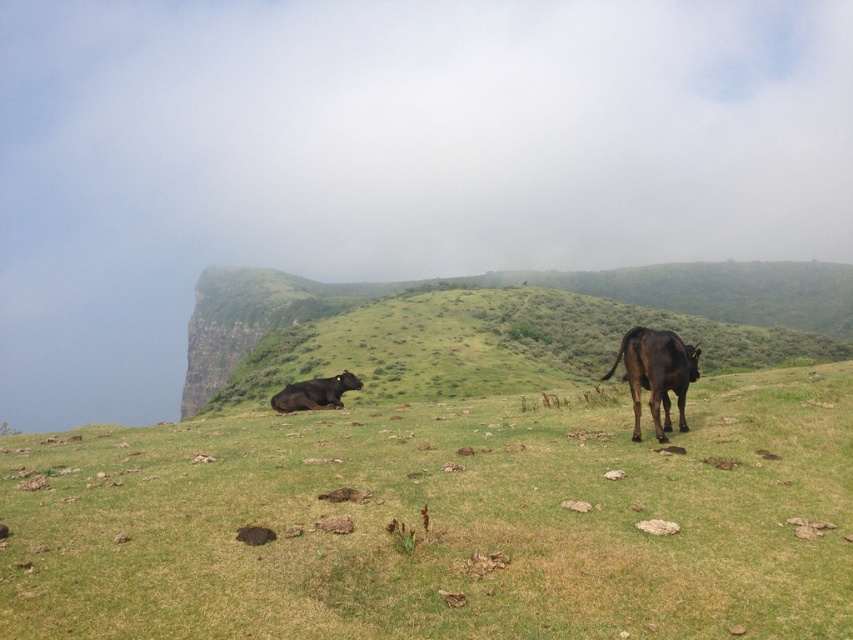
Question: Considering the real-world distances, which object is farthest from the green grassy at center?

Choices:
 (A) green grassy hillside at center
 (B) shiny brown bull at right
 (C) shiny black cow at center

Answer: (A)

Question: Can you confirm if green grassy hillside at center is positioned to the right of shiny black cow at center?

Choices:
 (A) yes
 (B) no

Answer: (B)

Question: Among these points, which one is farthest from the camera?

Choices:
 (A) (338, 506)
 (B) (344, 376)
 (C) (627, 348)
 (D) (187, 330)

Answer: (D)

Question: Which is nearer to the green grassy hillside at center?

Choices:
 (A) green grassy at center
 (B) shiny black cow at center
 (C) shiny brown bull at right

Answer: (A)

Question: Considering the relative positions of green grassy hillside at center and shiny black cow at center in the image provided, where is green grassy hillside at center located with respect to shiny black cow at center?

Choices:
 (A) above
 (B) below

Answer: (A)

Question: Is green grassy at center closer to camera compared to green grassy hillside at center?

Choices:
 (A) no
 (B) yes

Answer: (B)